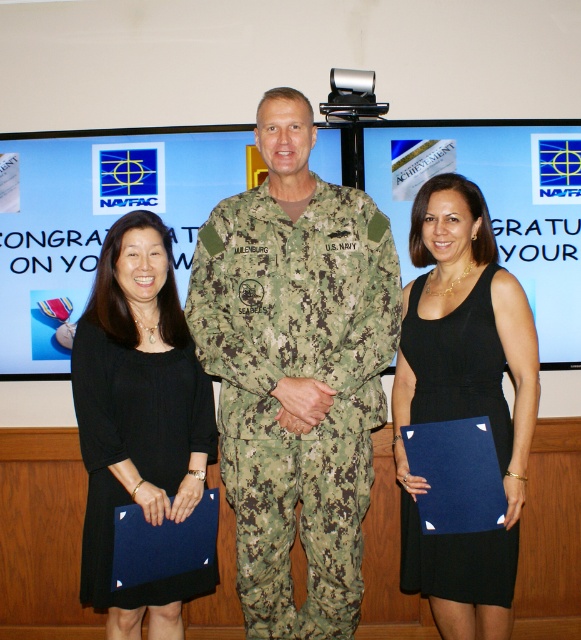
You are a photographer at a ceremony. You need to position a microphone stand between the camouflage uniform at center and the black dress at center so that it is equidistant from both. Is this possible given their heights?

The camouflage uniform at center is taller than the black dress at center. Since the microphone stand needs to be equidistant from both, their heights do not affect the placement. The stand can be positioned equidistant between them regardless of their height difference.